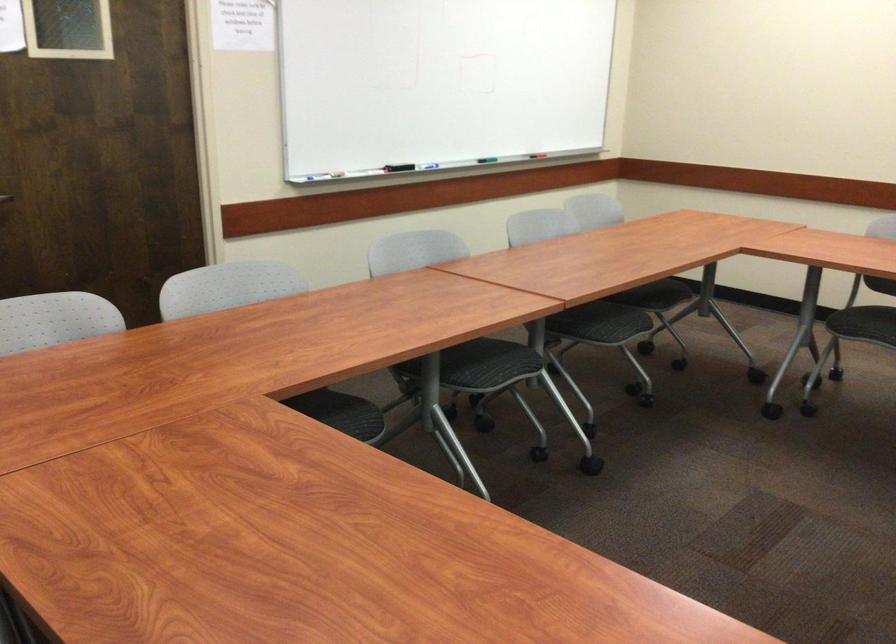
The images are taken continuously from a first-person perspective. In which direction is your viewpoint rotating?

The camera rotated toward right-down.